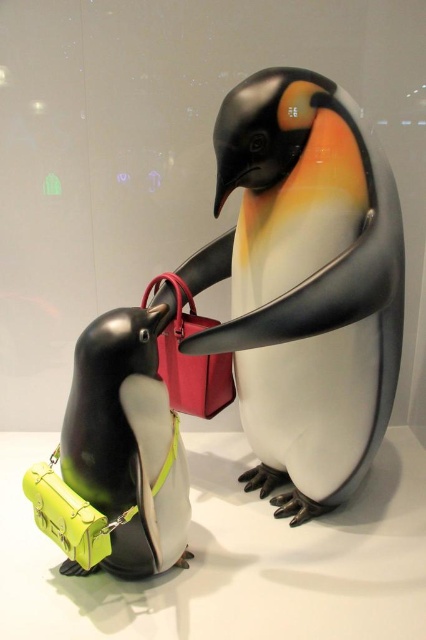
Is glossy plastic penguin at center thinner than matte green leather bag at lower left?

No.

Consider the image. Between glossy plastic penguin at center and matte green leather bag at lower left, which one has less height?

matte green leather bag at lower left is shorter.

Is point (253, 300) more distant than point (109, 369)?

Yes, point (253, 300) is farther from viewer.

Find the location of a particular element. The height and width of the screenshot is (640, 426). glossy plastic penguin at center is located at coordinates (305, 285).

Does glossy plastic penguin at center appear on the left side of matte red leather handbag at center?

No, glossy plastic penguin at center is not to the left of matte red leather handbag at center.

Does point (367, 349) come farther from viewer compared to point (181, 381)?

No, it is in front of (181, 381).

The width and height of the screenshot is (426, 640). In order to click on glossy plastic penguin at center in this screenshot , I will do `click(305, 285)`.

How much distance is there between matte green leather bag at lower left and matte red leather handbag at center?

The distance of matte green leather bag at lower left from matte red leather handbag at center is 40.57 centimeters.

Which is more to the left, matte green leather bag at lower left or matte red leather handbag at center?

Positioned to the left is matte green leather bag at lower left.

I want to click on matte green leather bag at lower left, so click(126, 442).